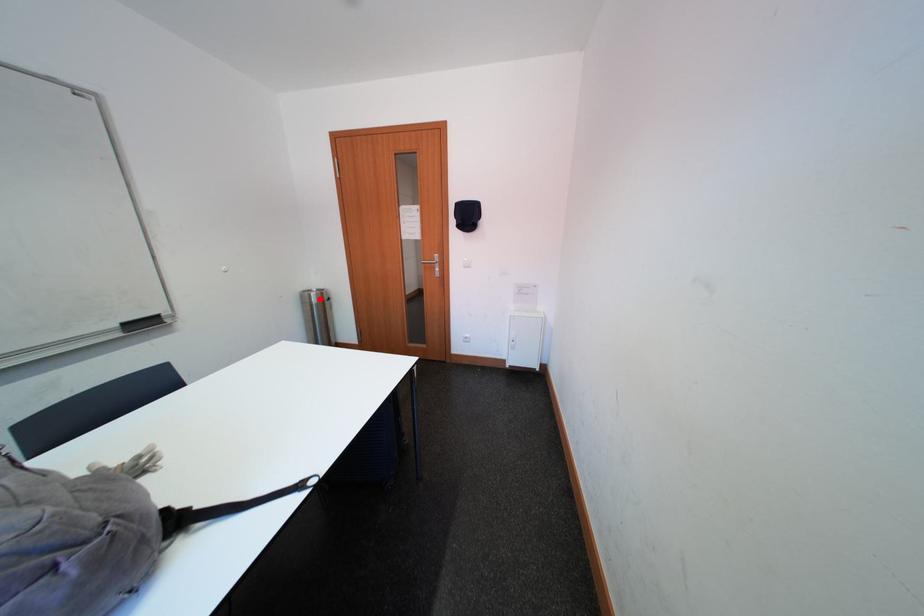
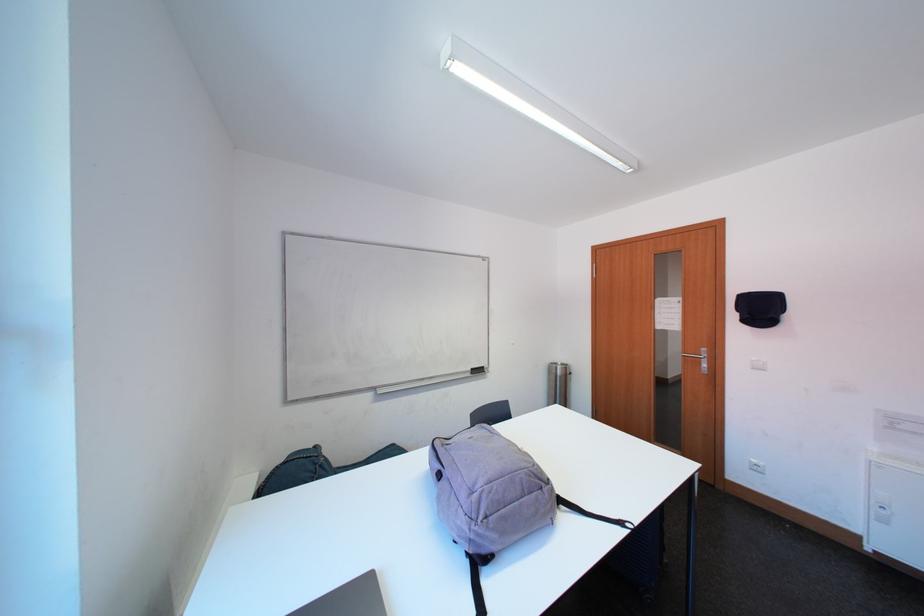
In the second image, find the point that corresponds to the highlighted location in the first image.

(565, 371)